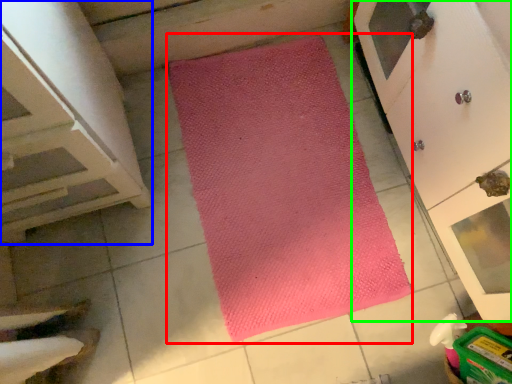
Question: Which object is positioned farthest from mat (highlighted by a red box)? Select from cabinetry (highlighted by a blue box) and cupboard (highlighted by a green box).

Choices:
 (A) cabinetry
 (B) cupboard

Answer: (A)